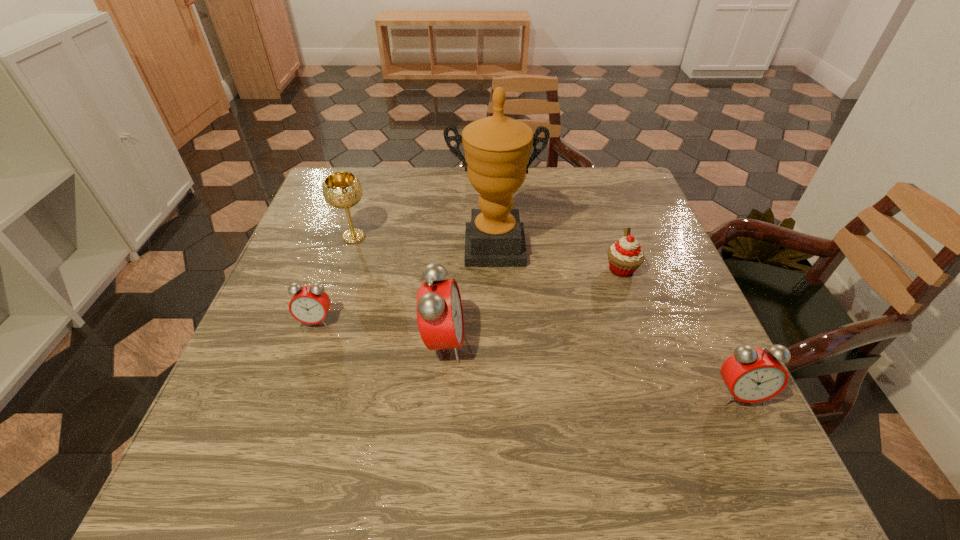
At what (x,y) coordinates should I click in order to perform the action: click on vacant spot for a new alarm_clock to ensure equal spacing. Please return your answer as a coordinate pair (x, y). This screenshot has height=540, width=960. Looking at the image, I should click on coord(585,367).